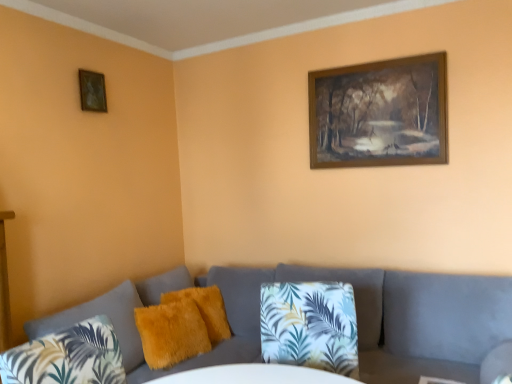
Find the location of a particular element. The image size is (512, 384). wooden frame at upper right, the 1th picture frame from the right is located at coordinates (379, 113).

The image size is (512, 384). Identify the location of fuzzy yellow pillow at center, arranged as the third pillow when viewed from the front. (205, 309).

In the scene shown: What's the angular difference between velvet grey couch at lower center and blue-green leaf-patterned fabric pillow at center, positioned as the 1th pillow in front-to-back order,'s facing directions?

The angular difference between velvet grey couch at lower center and blue-green leaf-patterned fabric pillow at center, positioned as the 1th pillow in front-to-back order, is 20.7 degrees.

Is blue-green leaf-patterned fabric pillow at center, positioned as the 1th pillow in front-to-back order, inside velvet grey couch at lower center?

Yes, blue-green leaf-patterned fabric pillow at center, positioned as the 1th pillow in front-to-back order, is inside velvet grey couch at lower center.

Measure the distance between velvet grey couch at lower center and blue-green leaf-patterned fabric pillow at center, positioned as the 1th pillow in front-to-back order.

The distance of velvet grey couch at lower center from blue-green leaf-patterned fabric pillow at center, positioned as the 1th pillow in front-to-back order, is 25.25 inches.

Which is more to the left, velvet grey couch at lower center or blue-green leaf-patterned fabric pillow at center, the 3th pillow when ordered from back to front?

velvet grey couch at lower center is more to the left.

Considering the sizes of objects velvet grey couch at lower center and fuzzy yellow pillow at center, which ranks as the 2th pillow in back-to-front order, in the image provided, who is shorter, velvet grey couch at lower center or fuzzy yellow pillow at center, which ranks as the 2th pillow in back-to-front order,?

With less height is fuzzy yellow pillow at center, which ranks as the 2th pillow in back-to-front order.

Is there a large distance between velvet grey couch at lower center and fuzzy yellow pillow at center, which ranks as the 2th pillow in back-to-front order?

velvet grey couch at lower center is actually quite close to fuzzy yellow pillow at center, which ranks as the 2th pillow in back-to-front order.

Identify the location of pillow that is the 1st object located above the velvet grey couch at lower center (from the image's perspective). The height and width of the screenshot is (384, 512). (170, 333).

Is velvet grey couch at lower center facing away from fuzzy yellow pillow at center, which ranks as the 2th pillow in back-to-front order?

Yes, velvet grey couch at lower center is positioned with its back facing fuzzy yellow pillow at center, which ranks as the 2th pillow in back-to-front order.

Based on their sizes in the image, would you say fuzzy yellow pillow at center, which appears as the 2th pillow when viewed from the front, is bigger or smaller than velvet grey couch at lower center?

Considering their sizes, fuzzy yellow pillow at center, which appears as the 2th pillow when viewed from the front, takes up less space than velvet grey couch at lower center.

In terms of width, does fuzzy yellow pillow at center, which ranks as the 2th pillow in back-to-front order, look wider or thinner when compared to velvet grey couch at lower center?

Clearly, fuzzy yellow pillow at center, which ranks as the 2th pillow in back-to-front order, has less width compared to velvet grey couch at lower center.

From a real-world perspective, which pillow is the 1st one above the velvet grey couch at lower center? Please provide its 2D coordinates.

[(170, 333)]

From the image's perspective, which one is positioned lower, wooden picture frame at upper left, arranged as the second picture frame when viewed from the right, or fuzzy yellow pillow at center, arranged as the third pillow when viewed from the front?

fuzzy yellow pillow at center, arranged as the third pillow when viewed from the front, is shown below in the image.

Considering the positions of objects wooden picture frame at upper left, arranged as the second picture frame when viewed from the right, and fuzzy yellow pillow at center, arranged as the third pillow when viewed from the front, in the image provided, who is more to the right, wooden picture frame at upper left, arranged as the second picture frame when viewed from the right, or fuzzy yellow pillow at center, arranged as the third pillow when viewed from the front,?

fuzzy yellow pillow at center, arranged as the third pillow when viewed from the front, is more to the right.

Based on the photo, between wooden picture frame at upper left, arranged as the second picture frame when viewed from the right, and fuzzy yellow pillow at center, arranged as the third pillow when viewed from the front, which one is positioned behind?

wooden picture frame at upper left, arranged as the second picture frame when viewed from the right, is further away from the camera.

Considering the sizes of wooden picture frame at upper left, arranged as the second picture frame when viewed from the right, and fuzzy yellow pillow at center, positioned as the 1th pillow in back-to-front order, in the image, is wooden picture frame at upper left, arranged as the second picture frame when viewed from the right, bigger or smaller than fuzzy yellow pillow at center, positioned as the 1th pillow in back-to-front order,?

Considering their sizes, wooden picture frame at upper left, arranged as the second picture frame when viewed from the right, takes up less space than fuzzy yellow pillow at center, positioned as the 1th pillow in back-to-front order.

Is velvet grey couch at lower center at the back of fuzzy yellow pillow at center, positioned as the 1th pillow in back-to-front order?

Yes, velvet grey couch at lower center is at the back of fuzzy yellow pillow at center, positioned as the 1th pillow in back-to-front order.

You are a GUI agent. You are given a task and a screenshot of the screen. Output one action in this format:
    pyautogui.click(x=<x>, y=<y>)
    Task: Click on the 2nd pillow positioned above the velvet grey couch at lower center (from the image's perspective)
    The width and height of the screenshot is (512, 384).
    Given the screenshot: What is the action you would take?
    pyautogui.click(x=205, y=309)

How distant is fuzzy yellow pillow at center, arranged as the third pillow when viewed from the front, from velvet grey couch at lower center?

fuzzy yellow pillow at center, arranged as the third pillow when viewed from the front, is 18.69 inches away from velvet grey couch at lower center.

Is fuzzy yellow pillow at center, arranged as the third pillow when viewed from the front, shorter than velvet grey couch at lower center?

Indeed, fuzzy yellow pillow at center, arranged as the third pillow when viewed from the front, has a lesser height compared to velvet grey couch at lower center.

Looking at their sizes, would you say wooden picture frame at upper left, arranged as the second picture frame when viewed from the right, is wider or thinner than blue-green leaf-patterned fabric pillow at center, the 3th pillow when ordered from back to front?

Clearly, wooden picture frame at upper left, arranged as the second picture frame when viewed from the right, has less width compared to blue-green leaf-patterned fabric pillow at center, the 3th pillow when ordered from back to front.

How much distance is there between wooden picture frame at upper left, arranged as the second picture frame when viewed from the right, and blue-green leaf-patterned fabric pillow at center, positioned as the 1th pillow in front-to-back order?

They are 6.27 feet apart.

Consider the image. From a real-world perspective, is wooden picture frame at upper left, arranged as the second picture frame when viewed from the right, positioned above or below blue-green leaf-patterned fabric pillow at center, the 3th pillow when ordered from back to front?

wooden picture frame at upper left, arranged as the second picture frame when viewed from the right, is situated higher than blue-green leaf-patterned fabric pillow at center, the 3th pillow when ordered from back to front, in the real world.

Would you consider wooden picture frame at upper left, the first picture frame when ordered from left to right, to be distant from blue-green leaf-patterned fabric pillow at center, the 3th pillow when ordered from back to front?

wooden picture frame at upper left, the first picture frame when ordered from left to right, is positioned a significant distance from blue-green leaf-patterned fabric pillow at center, the 3th pillow when ordered from back to front.

Consider the image. From the image's perspective, is wooden frame at upper right, the 1th picture frame from the right, above or below fuzzy yellow pillow at center, which ranks as the 2th pillow in back-to-front order?

Clearly, from the image's perspective, wooden frame at upper right, the 1th picture frame from the right, is above fuzzy yellow pillow at center, which ranks as the 2th pillow in back-to-front order.

Considering the sizes of wooden frame at upper right, acting as the 2th picture frame starting from the left, and fuzzy yellow pillow at center, which ranks as the 2th pillow in back-to-front order, in the image, is wooden frame at upper right, acting as the 2th picture frame starting from the left, taller or shorter than fuzzy yellow pillow at center, which ranks as the 2th pillow in back-to-front order,?

In the image, wooden frame at upper right, acting as the 2th picture frame starting from the left, appears to be taller than fuzzy yellow pillow at center, which ranks as the 2th pillow in back-to-front order.

Is wooden frame at upper right, acting as the 2th picture frame starting from the left, in front of fuzzy yellow pillow at center, which ranks as the 2th pillow in back-to-front order?

No, wooden frame at upper right, acting as the 2th picture frame starting from the left, is further to the viewer.

Is wooden frame at upper right, the 1th picture frame from the right, to the right of fuzzy yellow pillow at center, which appears as the 2th pillow when viewed from the front, from the viewer's perspective?

Yes, wooden frame at upper right, the 1th picture frame from the right, is to the right of fuzzy yellow pillow at center, which appears as the 2th pillow when viewed from the front.

The image size is (512, 384). I want to click on studio couch below the blue-green leaf-patterned fabric pillow at center, positioned as the 1th pillow in front-to-back order (from a real-world perspective), so click(356, 314).

Image resolution: width=512 pixels, height=384 pixels. Find the location of `studio couch below the fuzzy yellow pillow at center, which appears as the 2th pillow when viewed from the front (from the image's perspective)`. studio couch below the fuzzy yellow pillow at center, which appears as the 2th pillow when viewed from the front (from the image's perspective) is located at coordinates (356, 314).

Considering their positions, is wooden picture frame at upper left, the first picture frame when ordered from left to right, positioned further to fuzzy yellow pillow at center, arranged as the third pillow when viewed from the front, than velvet grey couch at lower center?

Among the two, wooden picture frame at upper left, the first picture frame when ordered from left to right, is located further to fuzzy yellow pillow at center, arranged as the third pillow when viewed from the front.

When comparing their distances from fuzzy yellow pillow at center, which ranks as the 2th pillow in back-to-front order, does wooden picture frame at upper left, the first picture frame when ordered from left to right, or velvet grey couch at lower center seem closer?

velvet grey couch at lower center lies closer to fuzzy yellow pillow at center, which ranks as the 2th pillow in back-to-front order, than the other object.

Which object lies nearer to the anchor point velvet grey couch at lower center, fuzzy yellow pillow at center, positioned as the 1th pillow in back-to-front order, or fuzzy yellow pillow at center, which ranks as the 2th pillow in back-to-front order?

The object closer to velvet grey couch at lower center is fuzzy yellow pillow at center, which ranks as the 2th pillow in back-to-front order.

Which object lies nearer to the anchor point wooden picture frame at upper left, arranged as the second picture frame when viewed from the right, fuzzy yellow pillow at center, which ranks as the 2th pillow in back-to-front order, or blue-green leaf-patterned fabric pillow at center, the 3th pillow when ordered from back to front?

Based on the image, fuzzy yellow pillow at center, which ranks as the 2th pillow in back-to-front order, appears to be nearer to wooden picture frame at upper left, arranged as the second picture frame when viewed from the right.

Looking at the image, which one is located closer to wooden picture frame at upper left, the first picture frame when ordered from left to right, fuzzy yellow pillow at center, arranged as the third pillow when viewed from the front, or wooden frame at upper right, acting as the 2th picture frame starting from the left?

Based on the image, fuzzy yellow pillow at center, arranged as the third pillow when viewed from the front, appears to be nearer to wooden picture frame at upper left, the first picture frame when ordered from left to right.

Which object lies further to the anchor point wooden frame at upper right, acting as the 2th picture frame starting from the left, velvet grey couch at lower center or blue-green leaf-patterned fabric pillow at center, positioned as the 1th pillow in front-to-back order?

blue-green leaf-patterned fabric pillow at center, positioned as the 1th pillow in front-to-back order, lies further to wooden frame at upper right, acting as the 2th picture frame starting from the left, than the other object.

From the image, which object appears to be nearer to wooden frame at upper right, acting as the 2th picture frame starting from the left, fuzzy yellow pillow at center, arranged as the third pillow when viewed from the front, or wooden picture frame at upper left, arranged as the second picture frame when viewed from the right?

The object closer to wooden frame at upper right, acting as the 2th picture frame starting from the left, is fuzzy yellow pillow at center, arranged as the third pillow when viewed from the front.

When comparing their distances from fuzzy yellow pillow at center, which ranks as the 2th pillow in back-to-front order, does wooden frame at upper right, the 1th picture frame from the right, or velvet grey couch at lower center seem closer?

Based on the image, velvet grey couch at lower center appears to be nearer to fuzzy yellow pillow at center, which ranks as the 2th pillow in back-to-front order.

Locate an element on the screen. The height and width of the screenshot is (384, 512). pillow between wooden frame at upper right, the 1th picture frame from the right, and fuzzy yellow pillow at center, arranged as the third pillow when viewed from the front, in the up-down direction is located at coordinates (310, 326).

Find the location of a particular element. pillow between blue-green leaf-patterned fabric pillow at center, the 3th pillow when ordered from back to front, and fuzzy yellow pillow at center, positioned as the 1th pillow in back-to-front order, along the z-axis is located at coordinates (170, 333).

You are a GUI agent. You are given a task and a screenshot of the screen. Output one action in this format:
    pyautogui.click(x=<x>, y=<y>)
    Task: Click on the pillow between wooden picture frame at upper left, the first picture frame when ordered from left to right, and fuzzy yellow pillow at center, positioned as the 1th pillow in back-to-front order, from top to bottom
    The height and width of the screenshot is (384, 512).
    Given the screenshot: What is the action you would take?
    pyautogui.click(x=310, y=326)

In order to click on picture frame between velvet grey couch at lower center and fuzzy yellow pillow at center, positioned as the 1th pillow in back-to-front order, along the z-axis in this screenshot , I will do `click(379, 113)`.